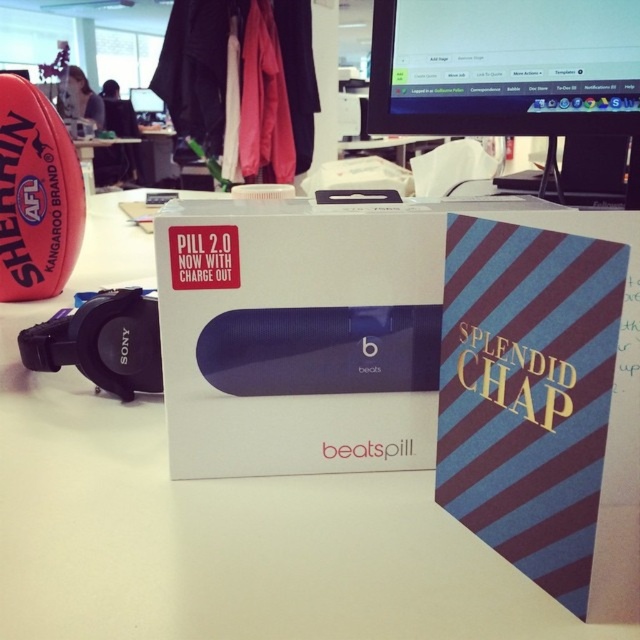
You are a photographer trying to capture a closeup of the AFL football and the Beats Pill 2.0 box. You want to focus on the AFL football first. Which point should you adjust your camera focus to first, point (396, 124) or point (141, 93)?

Point (396, 124) is closer to the camera than point (141, 93), so you should focus on point (396, 124) first to capture the AFL football closeup.

You are setting up a workstation and need to place a new monitor. Based on the scene, where should the black glossy monitor at upper center be positioned relative to the white matte table at center?

The black glossy monitor at upper center should be placed above the white matte table at center since the white matte table at center is below the black glossy monitor at upper center.

You are standing in front of the desk and want to place a small sticker exactly halfway between the two points labeled point (410, 273) and point (152, 96). Will the sticker be closer to the viewer or farther away compared to the original points?

The sticker placed halfway between point (410, 273) and point (152, 96) will be closer to the viewer than point (152, 96) but farther away than point (410, 273). Since point (410, 273) is closer to the viewer than point (152, 96), the midpoint will lie between their depths.